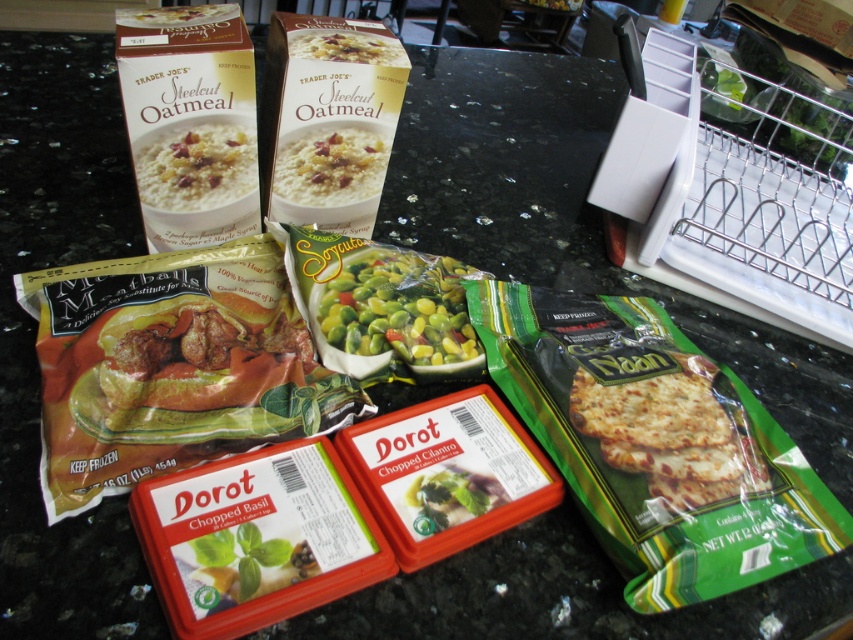
You are organizing the freezer and need to place the green matte frozen peas at center and the white matte steel cut oatmeal at upper center. If you want to move the peas to the left side of the oatmeal, which direction should you move them?

The green matte frozen peas at center is currently to the right of the white matte steel cut oatmeal at upper center. To move them to the left side of the oatmeal, you should move the peas to the left.

You are organizing a pantry and need to place the green matte frozen peas at center and the white matte steel cut oatmeal at upper center. According to their positions in the image, which item should you place higher up?

The white matte steel cut oatmeal at upper center should be placed higher up since it is positioned above the green matte frozen peas at center in the image.